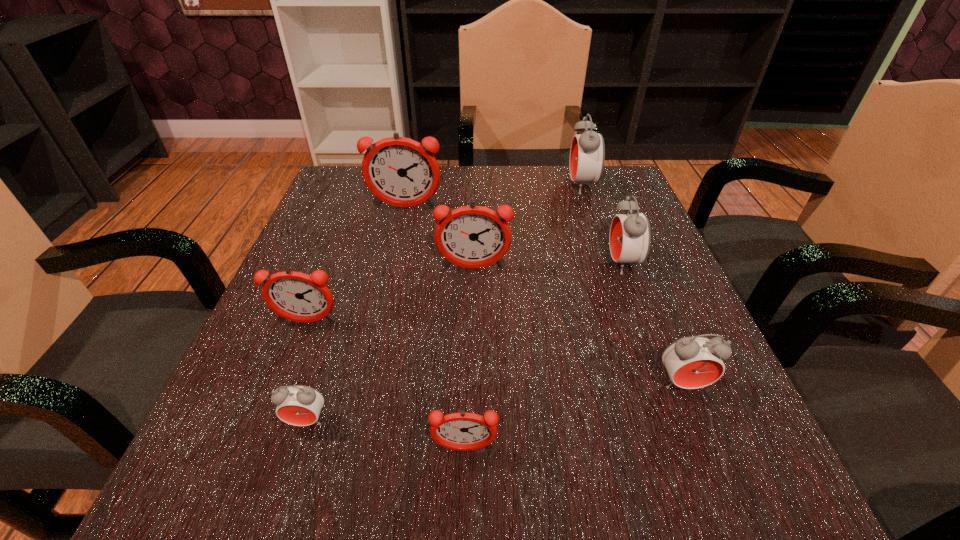
Image resolution: width=960 pixels, height=540 pixels. Find the location of `vacant space located on the face of the second farthest red alarm clock`. vacant space located on the face of the second farthest red alarm clock is located at coordinates (498, 264).

Where is `vacant space situated 0.060m on the front-facing side of the third smallest reddish-pink alarm clock`? This screenshot has height=540, width=960. vacant space situated 0.060m on the front-facing side of the third smallest reddish-pink alarm clock is located at coordinates (473, 295).

The height and width of the screenshot is (540, 960). Identify the location of vacant area situated 0.210m on the front-facing side of the fifth farthest alarm clock. (259, 444).

Locate an element on the screen. The height and width of the screenshot is (540, 960). vacant point located on the face of the sixth farthest alarm clock is located at coordinates (706, 441).

Locate an element on the screen. The image size is (960, 540). object at the near edge is located at coordinates (463, 431).

Find the location of a particular element. object that is positioned at the far left corner is located at coordinates (400, 171).

Identify the location of object present at the far right corner. (587, 154).

Where is `free space at the far edge of the desktop`? The width and height of the screenshot is (960, 540). free space at the far edge of the desktop is located at coordinates (500, 189).

Where is `blank space at the near edge of the desktop`? Image resolution: width=960 pixels, height=540 pixels. blank space at the near edge of the desktop is located at coordinates (492, 487).

The height and width of the screenshot is (540, 960). Find the location of `vacant space at the left edge of the desktop`. vacant space at the left edge of the desktop is located at coordinates (x=332, y=239).